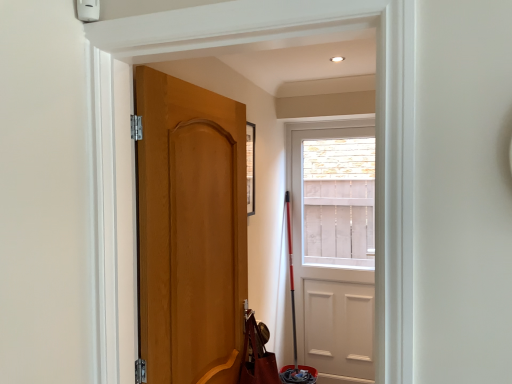
This screenshot has width=512, height=384. Identify the location of blank space situated above white matte door at center, which is counted as the 2th door, starting from the left (from a real-world perspective). (327, 127).